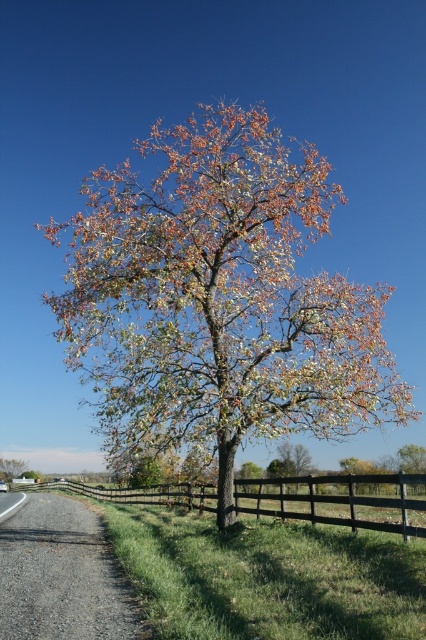
You are planning to place a 1.2 meter wide picnic blanket in the scene. Given the space occupied by the autumn leaves wood at center and the green leafy tree at center, which object would allow the blanket to fit better without overlapping?

The green leafy tree at center has a smaller width compared to the autumn leaves wood at center, so placing the picnic blanket near the green leafy tree at center would provide enough space for the 1.2 meter wide blanket without overlapping.

You are standing in the rural area looking at the solitary tree. There are two points marked on the ground near the tree. The first point is at coordinates point [124,588] and the second at point [374,516]. Which point is closer to you?

Point [124,588] is closer to the viewer than point [374,516].